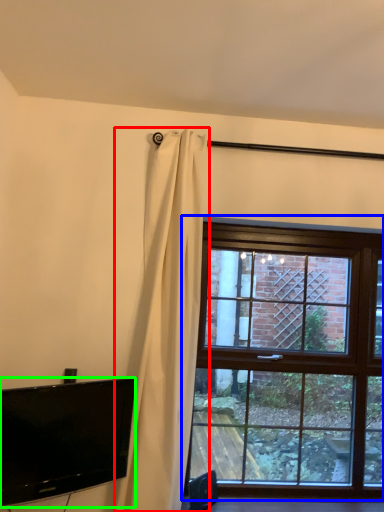
Question: Based on their relative distances, which object is nearer to curtain (highlighted by a red box)? Choose from window (highlighted by a blue box) and television (highlighted by a green box).

Choices:
 (A) window
 (B) television

Answer: (B)